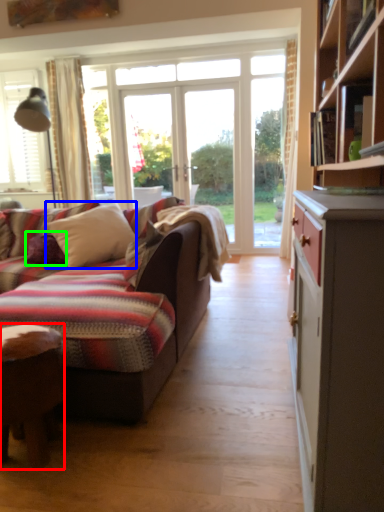
Question: Which object is positioned closest to desk (highlighted by a red box)? Select from pillow (highlighted by a blue box) and pillow (highlighted by a green box).

Choices:
 (A) pillow
 (B) pillow

Answer: (A)